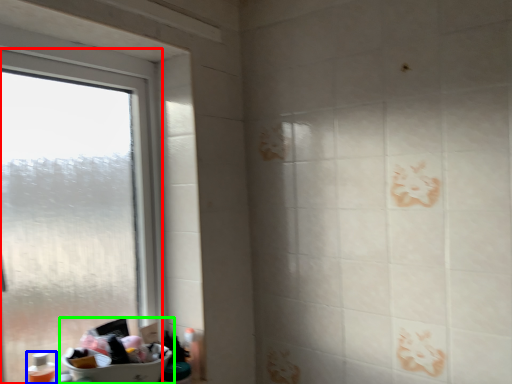
Question: Considering the real-world distances, which object is closest to window (highlighted by a red box)? toiletry (highlighted by a blue box) or sink (highlighted by a green box).

Choices:
 (A) toiletry
 (B) sink

Answer: (B)